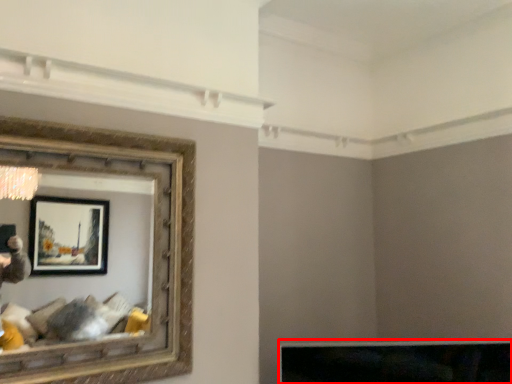
Question: From the image, what is the correct spatial relationship of furniture (annotated by the red box) in relation to picture frame?

Choices:
 (A) left
 (B) right

Answer: (B)